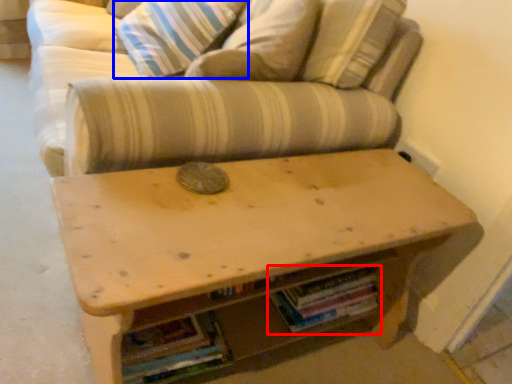
Question: Which of the following is the farthest to the observer, book (highlighted by a red box) or pillow (highlighted by a blue box)?

Choices:
 (A) book
 (B) pillow

Answer: (B)